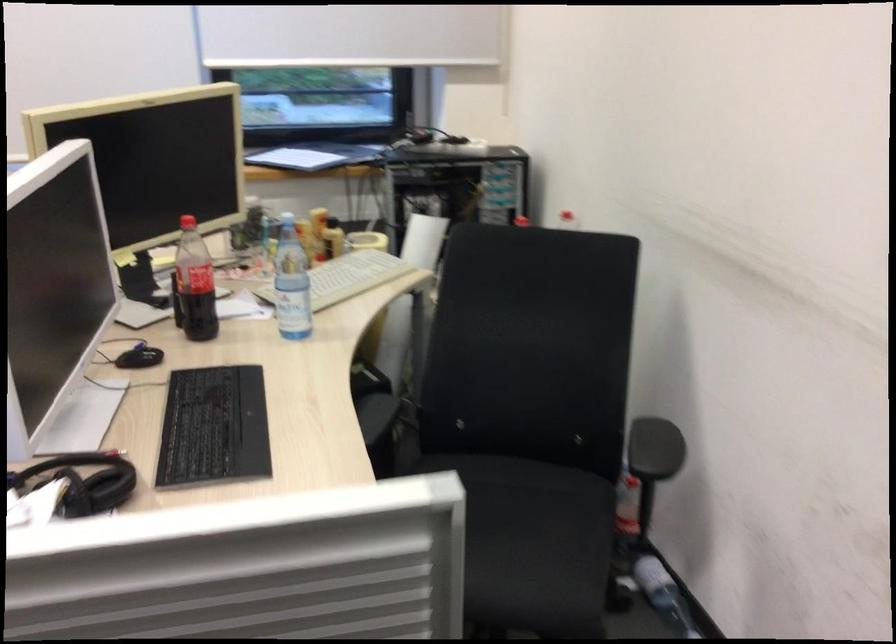
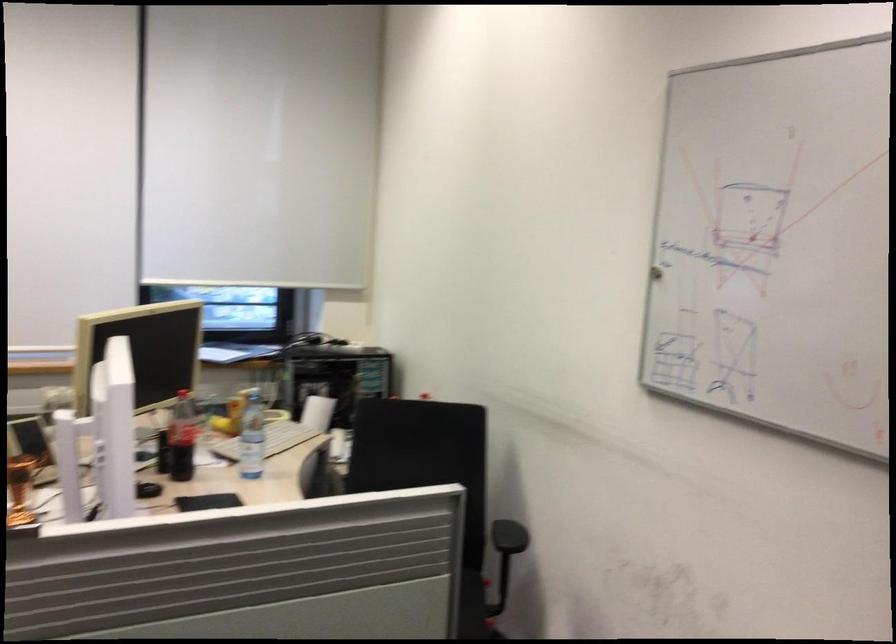
In the second image, find the point that corresponds to pixel 208 287 in the first image.

(182, 438)